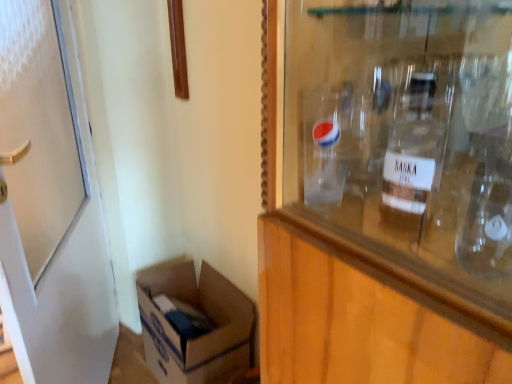
Question: Is clear glass bottle at upper right outside of white matte door at left?

Choices:
 (A) no
 (B) yes

Answer: (B)

Question: From a real-world perspective, does clear glass bottle at upper right stand above white matte door at left?

Choices:
 (A) no
 (B) yes

Answer: (B)

Question: Can you confirm if clear glass bottle at upper right is positioned to the left of white matte door at left?

Choices:
 (A) yes
 (B) no

Answer: (B)

Question: Does clear glass bottle at upper right appear on the right side of white matte door at left?

Choices:
 (A) yes
 (B) no

Answer: (A)

Question: From a real-world perspective, is clear glass bottle at upper right physically below white matte door at left?

Choices:
 (A) no
 (B) yes

Answer: (A)

Question: Based on their positions, is white cardboard box at lower left located to the left or right of clear glass bottle at upper right?

Choices:
 (A) right
 (B) left

Answer: (B)

Question: From the image's perspective, is white cardboard box at lower left located above or below clear glass bottle at upper right?

Choices:
 (A) below
 (B) above

Answer: (A)

Question: Is white cardboard box at lower left inside or outside of clear glass bottle at upper right?

Choices:
 (A) outside
 (B) inside

Answer: (A)

Question: Looking at their shapes, would you say white cardboard box at lower left is wider or thinner than clear glass bottle at upper right?

Choices:
 (A) wide
 (B) thin

Answer: (A)

Question: From a real-world perspective, relative to white cardboard box at lower left, is clear glass bottle at upper right vertically above or below?

Choices:
 (A) above
 (B) below

Answer: (A)

Question: Is clear glass bottle at upper right wider or thinner than white cardboard box at lower left?

Choices:
 (A) thin
 (B) wide

Answer: (A)

Question: From their relative heights in the image, would you say clear glass bottle at upper right is taller or shorter than white cardboard box at lower left?

Choices:
 (A) short
 (B) tall

Answer: (A)

Question: Does point (406, 89) appear closer or farther from the camera than point (153, 367)?

Choices:
 (A) closer
 (B) farther

Answer: (A)

Question: From a real-world perspective, is white cardboard box at lower left physically located above or below white matte door at left?

Choices:
 (A) above
 (B) below

Answer: (B)

Question: From the image's perspective, is white cardboard box at lower left above or below white matte door at left?

Choices:
 (A) above
 (B) below

Answer: (B)